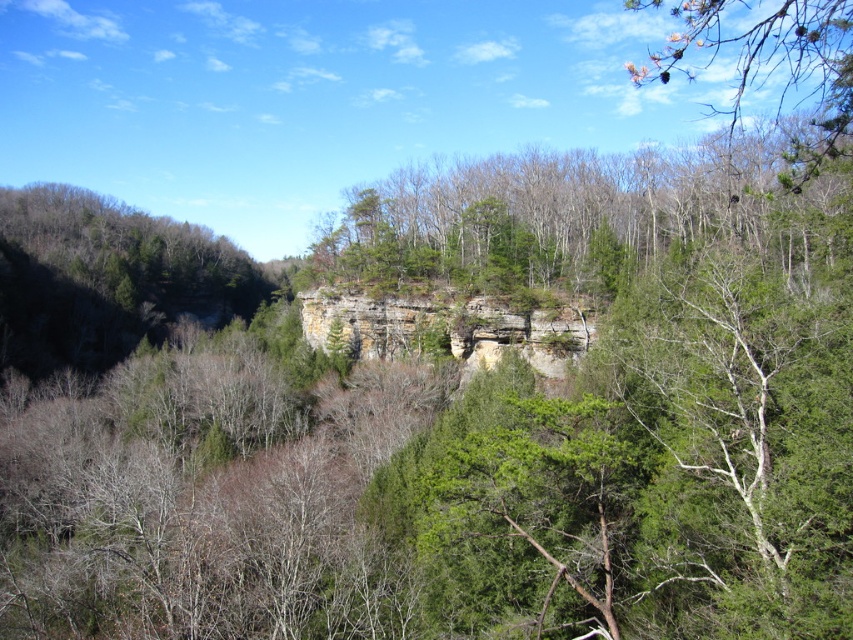
Is green leafy tree at center bigger than rustic stone cliff at center?

Correct, green leafy tree at center is larger in size than rustic stone cliff at center.

Is green leafy tree at center above rustic stone cliff at center?

Indeed, green leafy tree at center is positioned over rustic stone cliff at center.

Is point (625, 250) closer to viewer compared to point (322, 300)?

Yes, it is.

The width and height of the screenshot is (853, 640). Find the location of `green leafy tree at center`. green leafy tree at center is located at coordinates (584, 216).

What do you see at coordinates (584, 216) in the screenshot? I see `green leafy tree at center` at bounding box center [584, 216].

Does green leafy tree at center appear on the right side of green textured pine branch at upper right?

Incorrect, green leafy tree at center is not on the right side of green textured pine branch at upper right.

Which is behind, point (675, 230) or point (733, 120)?

The point (733, 120) is behind.

Identify the location of green leafy tree at center. The width and height of the screenshot is (853, 640). (584, 216).

Is green textured pine branch at upper right smaller than rustic stone cliff at center?

No.

Is green textured pine branch at upper right positioned in front of rustic stone cliff at center?

Yes, it is.

In order to click on green textured pine branch at upper right in this screenshot , I will do `click(775, 61)`.